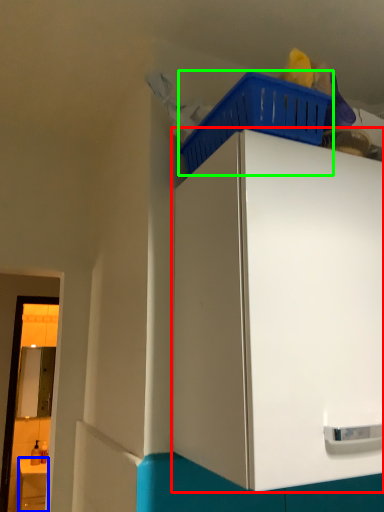
Question: Considering the real-world distances, which object is farthest from cabinetry (highlighted by a red box)? counter (highlighted by a blue box) or basket (highlighted by a green box)?

Choices:
 (A) counter
 (B) basket

Answer: (A)